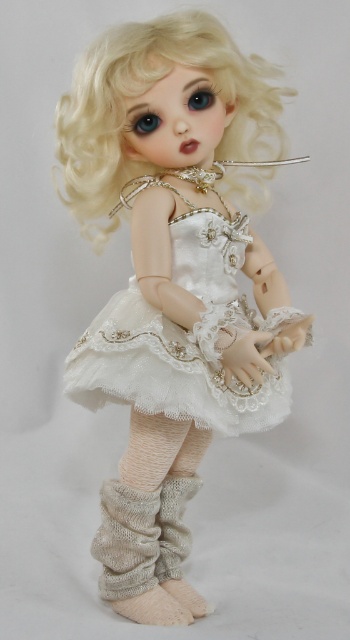
You are an artist sketching the doll and want to add more details to the area at point [144,92]. What feature of the doll is located there?

The area at point [144,92] has the blonde curly hair at upper center.

You are a fashion designer observing the doll. You need to determine which item is smaller in size between the white lace dress at center and the blonde curly hair at upper center. Which one is smaller?

The white lace dress at center is smaller than the blonde curly hair at upper center according to the description.